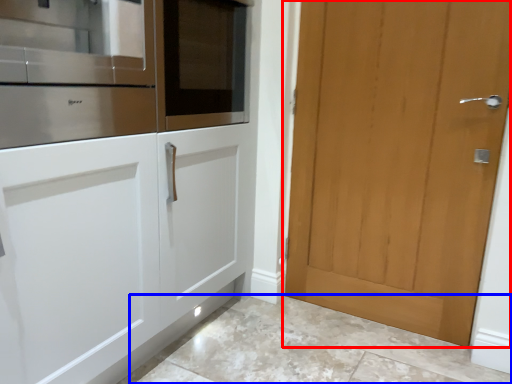
Question: Which of the following is the farthest to the observer, door (highlighted by a red box) or granite (highlighted by a blue box)?

Choices:
 (A) door
 (B) granite

Answer: (A)